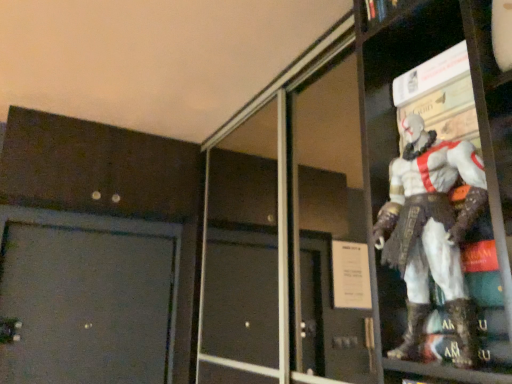
Where is `transparent glass screen door at upper right`? The image size is (512, 384). transparent glass screen door at upper right is located at coordinates (289, 244).

What is the approximate height of transparent glass screen door at upper right?

It is 1.41 meters.

Describe the element at coordinates (289, 244) in the screenshot. This screenshot has width=512, height=384. I see `transparent glass screen door at upper right` at that location.

What are the coordinates of `white matte figure at upper right` in the screenshot? It's located at (437, 189).

The width and height of the screenshot is (512, 384). What do you see at coordinates (437, 189) in the screenshot?
I see `white matte figure at upper right` at bounding box center [437, 189].

Looking at this image, measure the distance between white matte figure at upper right and camera.

white matte figure at upper right and camera are 25.70 inches apart from each other.

Where is `transparent glass screen door at upper right`? transparent glass screen door at upper right is located at coordinates (289, 244).

Is transparent glass screen door at upper right to the left of white matte figure at upper right from the viewer's perspective?

Indeed, transparent glass screen door at upper right is positioned on the left side of white matte figure at upper right.

Does transparent glass screen door at upper right lie behind white matte figure at upper right?

Yes, transparent glass screen door at upper right is further from the camera.

Is point (319, 199) closer or farther from the camera than point (489, 301)?

Clearly, point (319, 199) is more distant from the camera than point (489, 301).

From the image's perspective, which is above, transparent glass screen door at upper right or white matte figure at upper right?

white matte figure at upper right, from the image's perspective.

From a real-world perspective, is transparent glass screen door at upper right on white matte figure at upper right?

Correct, in the physical world, transparent glass screen door at upper right is higher than white matte figure at upper right.

Considering the relative sizes of transparent glass screen door at upper right and white matte figure at upper right in the image provided, is transparent glass screen door at upper right thinner than white matte figure at upper right?

Indeed, transparent glass screen door at upper right has a lesser width compared to white matte figure at upper right.

Between transparent glass screen door at upper right and white matte figure at upper right, which one has more height?

With more height is transparent glass screen door at upper right.

Considering the sizes of objects transparent glass screen door at upper right and white matte figure at upper right in the image provided, who is bigger, transparent glass screen door at upper right or white matte figure at upper right?

transparent glass screen door at upper right.

Would you say transparent glass screen door at upper right contains white matte figure at upper right?

No, white matte figure at upper right is located outside of transparent glass screen door at upper right.

Does transparent glass screen door at upper right touch white matte figure at upper right?

No, transparent glass screen door at upper right is not with white matte figure at upper right.

Based on the photo, is white matte figure at upper right at the back of transparent glass screen door at upper right?

No, transparent glass screen door at upper right's orientation is not away from white matte figure at upper right.

There is a white matte figure at upper right. At what (x,y) coordinates should I click in order to perform the action: click on screen door above it (from a real-world perspective). Please return your answer as a coordinate pair (x, y). The width and height of the screenshot is (512, 384). Looking at the image, I should click on (289, 244).

Does white matte figure at upper right appear on the right side of transparent glass screen door at upper right?

Yes.

Who is more distant, white matte figure at upper right or transparent glass screen door at upper right?

transparent glass screen door at upper right is behind.

Is point (496, 172) positioned in front of point (221, 180)?

Yes, it is in front of point (221, 180).

From the image's perspective, is white matte figure at upper right located beneath transparent glass screen door at upper right?

No.

From a real-world perspective, is white matte figure at upper right positioned above or below transparent glass screen door at upper right?

From a real-world perspective, white matte figure at upper right is physically below transparent glass screen door at upper right.

Which object is thinner, white matte figure at upper right or transparent glass screen door at upper right?

Thinner between the two is transparent glass screen door at upper right.

Between white matte figure at upper right and transparent glass screen door at upper right, which one has less height?

white matte figure at upper right is shorter.

Is white matte figure at upper right smaller than transparent glass screen door at upper right?

Indeed, white matte figure at upper right has a smaller size compared to transparent glass screen door at upper right.

Would you say white matte figure at upper right is inside or outside transparent glass screen door at upper right?

white matte figure at upper right is located beyond the bounds of transparent glass screen door at upper right.

Would you say white matte figure at upper right is a long distance from transparent glass screen door at upper right?

Yes, white matte figure at upper right and transparent glass screen door at upper right are located far from each other.

Is white matte figure at upper right facing towards transparent glass screen door at upper right?

No, white matte figure at upper right is not turned towards transparent glass screen door at upper right.

Where is `screen door behind the white matte figure at upper right`? The image size is (512, 384). screen door behind the white matte figure at upper right is located at coordinates (289, 244).

Locate an element on the screen. This screenshot has height=384, width=512. screen door on the left of white matte figure at upper right is located at coordinates (289, 244).

Locate an element on the screen. The width and height of the screenshot is (512, 384). shelf in front of the transparent glass screen door at upper right is located at coordinates (437, 189).